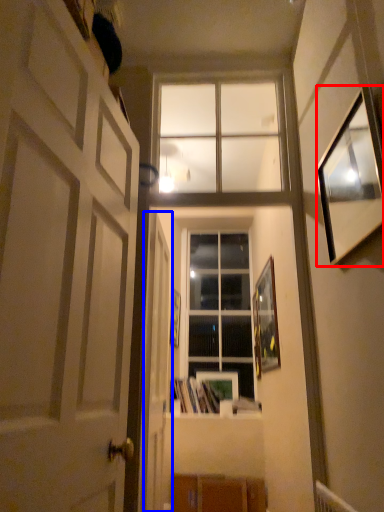
Question: Which of the following is the closest to the observer, picture frame (highlighted by a red box) or door (highlighted by a blue box)?

Choices:
 (A) picture frame
 (B) door

Answer: (A)